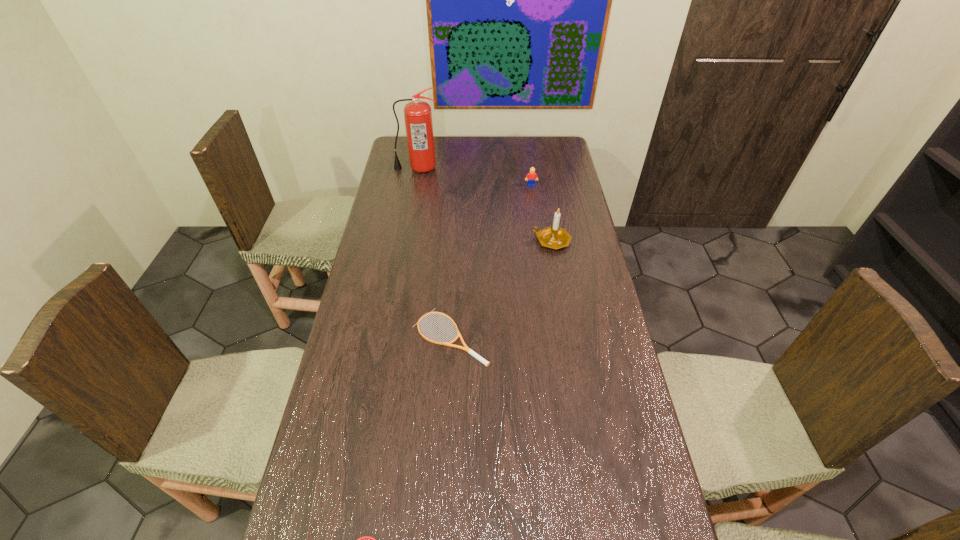
You are a GUI agent. You are given a task and a screenshot of the screen. Output one action in this format:
    pyautogui.click(x=<x>, y=<y>)
    Task: Click on the vacant space situated 0.210m on the face of the fourth nearest object
    
    Given the screenshot: What is the action you would take?
    pyautogui.click(x=536, y=218)

This screenshot has width=960, height=540. In order to click on vacant area located 0.260m on the right of the taller tennis racket in this screenshot , I will do 575,337.

The width and height of the screenshot is (960, 540). Identify the location of object that is at the far edge. [417, 114].

Image resolution: width=960 pixels, height=540 pixels. Find the location of `object positioned at the left edge`. object positioned at the left edge is located at coordinates (417, 114).

This screenshot has width=960, height=540. In order to click on object that is at the right edge in this screenshot , I will do click(x=554, y=237).

Where is `object at the far left corner`? The image size is (960, 540). object at the far left corner is located at coordinates (417, 114).

Locate an element on the screen. The width and height of the screenshot is (960, 540). free spot at the far edge of the desktop is located at coordinates (473, 137).

You are a GUI agent. You are given a task and a screenshot of the screen. Output one action in this format:
    pyautogui.click(x=<x>, y=<y>)
    Task: Click on the vacant region at the left edge
    The image size is (960, 540).
    Given the screenshot: What is the action you would take?
    pyautogui.click(x=340, y=451)

Image resolution: width=960 pixels, height=540 pixels. What are the coordinates of `vacant space at the right edge` in the screenshot? It's located at (596, 364).

Find the location of a particular element. The height and width of the screenshot is (540, 960). vacant area that lies between the candle holder and the second nearest object is located at coordinates (501, 289).